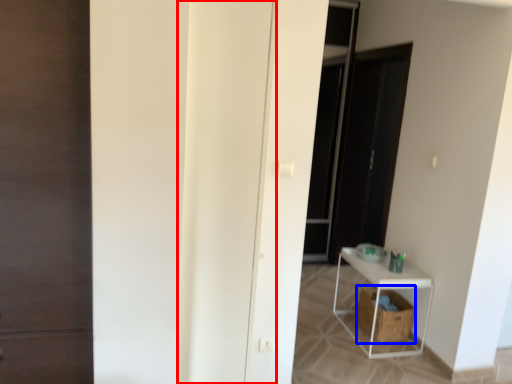
Question: Which object is further to the camera taking this photo, door (highlighted by a red box) or laundry basket (highlighted by a blue box)?

Choices:
 (A) door
 (B) laundry basket

Answer: (B)